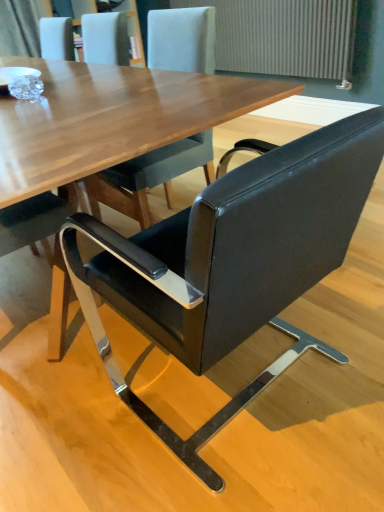
Question: Considering the relative positions of gray textured radiator at upper right and black leather chair at center in the image provided, is gray textured radiator at upper right to the left or to the right of black leather chair at center?

Choices:
 (A) left
 (B) right

Answer: (B)

Question: Is point (339, 13) positioned closer to the camera than point (268, 372)?

Choices:
 (A) farther
 (B) closer

Answer: (A)

Question: Considering the positions of gray textured radiator at upper right and black leather chair at center in the image, is gray textured radiator at upper right bigger or smaller than black leather chair at center?

Choices:
 (A) small
 (B) big

Answer: (A)

Question: Is point (337, 137) closer or farther from the camera than point (294, 5)?

Choices:
 (A) farther
 (B) closer

Answer: (B)

Question: From the image's perspective, is black leather chair at center located above or below gray textured radiator at upper right?

Choices:
 (A) above
 (B) below

Answer: (B)

Question: From a real-world perspective, is black leather chair at center physically located above or below gray textured radiator at upper right?

Choices:
 (A) above
 (B) below

Answer: (B)

Question: Is black leather chair at center wider or thinner than gray textured radiator at upper right?

Choices:
 (A) thin
 (B) wide

Answer: (B)